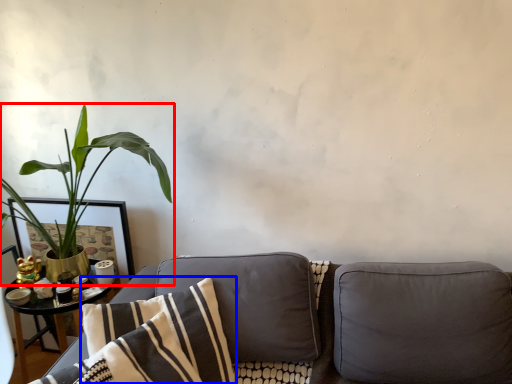
Question: Among these objects, which one is nearest to the camera, houseplant (highlighted by a red box) or pillow (highlighted by a blue box)?

Choices:
 (A) houseplant
 (B) pillow

Answer: (B)